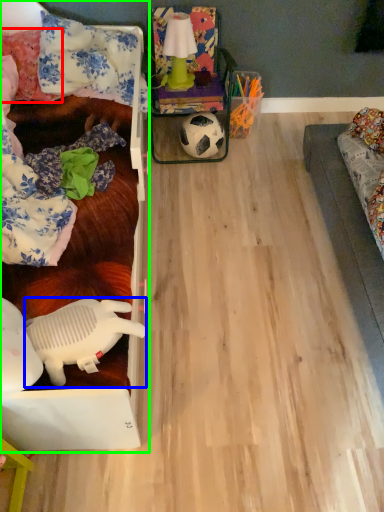
Question: Based on their relative distances, which object is nearer to pillow (highlighted by a red box)? Choose from toy (highlighted by a blue box) and furniture (highlighted by a green box).

Choices:
 (A) toy
 (B) furniture

Answer: (B)